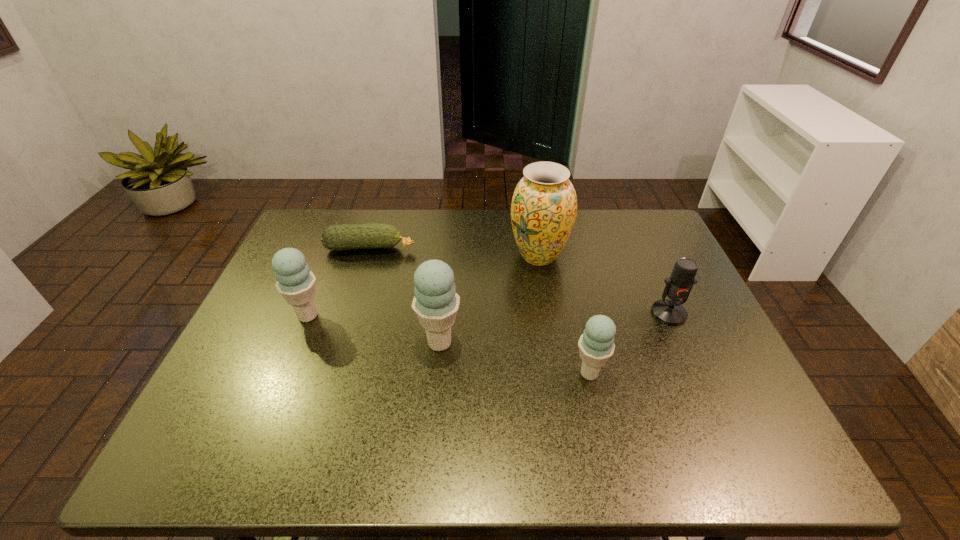
In order to click on the second shortest ice cream in this screenshot , I will do `click(296, 283)`.

I want to click on the leftmost ice cream, so click(x=296, y=283).

Find the location of `the second ice cream from right to left`. the second ice cream from right to left is located at coordinates (435, 303).

You are a GUI agent. You are given a task and a screenshot of the screen. Output one action in this format:
    pyautogui.click(x=<x>, y=<y>)
    Task: Click on the rightmost ice cream
    The image size is (960, 540).
    Given the screenshot: What is the action you would take?
    pyautogui.click(x=596, y=345)

The height and width of the screenshot is (540, 960). Identify the location of vase. (544, 206).

The height and width of the screenshot is (540, 960). In order to click on the shortest object in this screenshot , I will do `click(351, 236)`.

Where is `the rightmost object`? This screenshot has width=960, height=540. the rightmost object is located at coordinates (678, 286).

Identify the location of free space located on the right of the fourth shortest object. (458, 316).

Where is `free spot located on the back of the fourth object from right to left`? The width and height of the screenshot is (960, 540). free spot located on the back of the fourth object from right to left is located at coordinates (443, 309).

Locate an element on the screen. free location located on the back of the shortest ice cream is located at coordinates (576, 314).